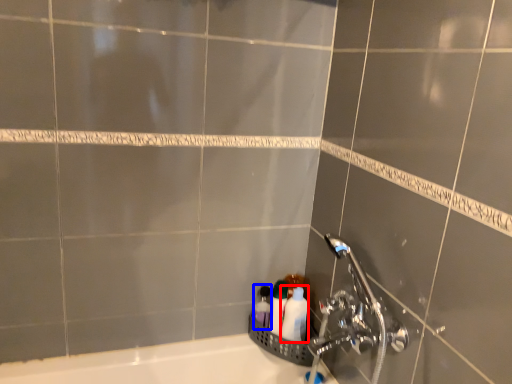
Question: Among these objects, which one is farthest to the camera, toiletry (highlighted by a red box) or toiletry (highlighted by a blue box)?

Choices:
 (A) toiletry
 (B) toiletry

Answer: (B)